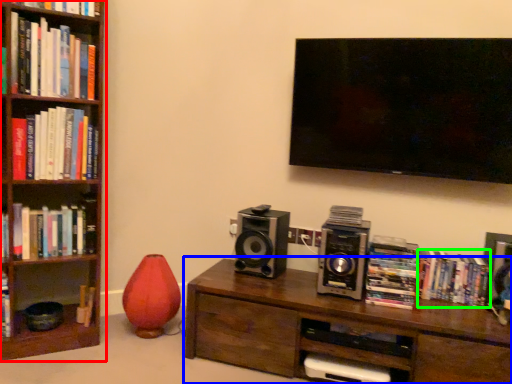
Question: Estimate the real-world distances between objects in this image. Which object is farther from bookcase (highlighted by a red box), table (highlighted by a blue box) or book (highlighted by a green box)?

Choices:
 (A) table
 (B) book

Answer: (B)